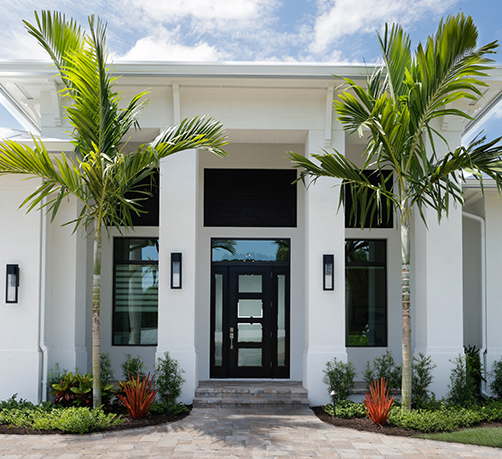
The width and height of the screenshot is (502, 459). I want to click on windows, so click(133, 247), click(356, 247), click(249, 247).